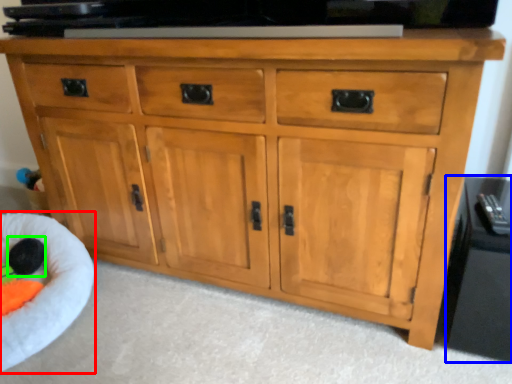
Question: Based on their relative distances, which object is farther from infant bed (highlighted by a red box)? Choose from side cabinet (highlighted by a blue box) and toy (highlighted by a green box).

Choices:
 (A) side cabinet
 (B) toy

Answer: (A)